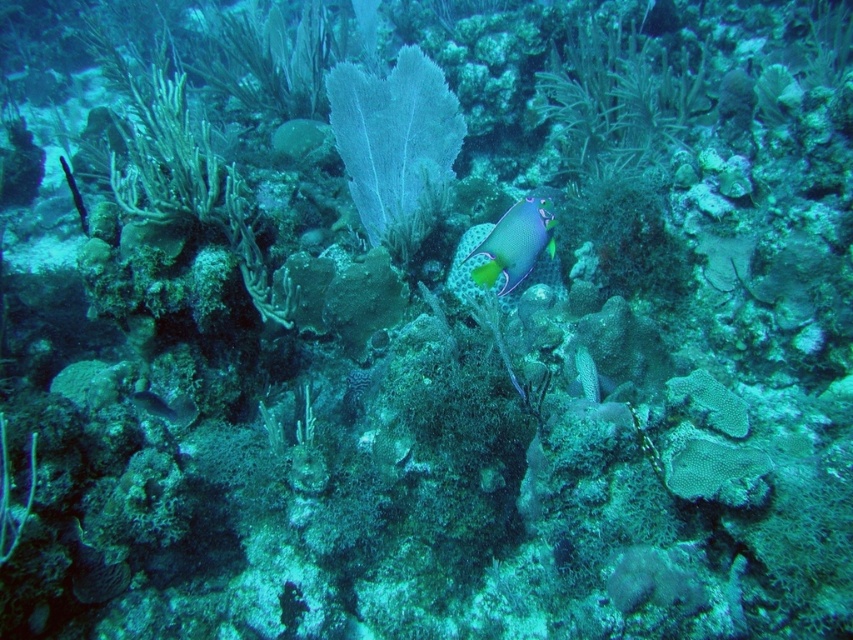
Based on the photo, measure the distance from translucent white coral at center to multicolored coral at center.

A distance of 19.01 inches exists between translucent white coral at center and multicolored coral at center.

Which of these two, translucent white coral at center or multicolored coral at center, stands shorter?

multicolored coral at center is shorter.

Describe the element at coordinates (396, 145) in the screenshot. I see `translucent white coral at center` at that location.

Where is `translucent white coral at center`? This screenshot has width=853, height=640. translucent white coral at center is located at coordinates (396, 145).

Find the location of a particular element. The height and width of the screenshot is (640, 853). translucent white coral at center is located at coordinates (396, 145).

Measure the distance between point (386, 204) and camera.

The distance of point (386, 204) from camera is 3.11 meters.

The width and height of the screenshot is (853, 640). What are the coordinates of `translucent white coral at center` in the screenshot? It's located at (396, 145).

Is multicolored coral at center smaller than shiny silver fish at lower left?

No.

Between multicolored coral at center and shiny silver fish at lower left, which one has less height?

With less height is shiny silver fish at lower left.

Locate an element on the screen. The image size is (853, 640). multicolored coral at center is located at coordinates (515, 243).

I want to click on multicolored coral at center, so click(515, 243).